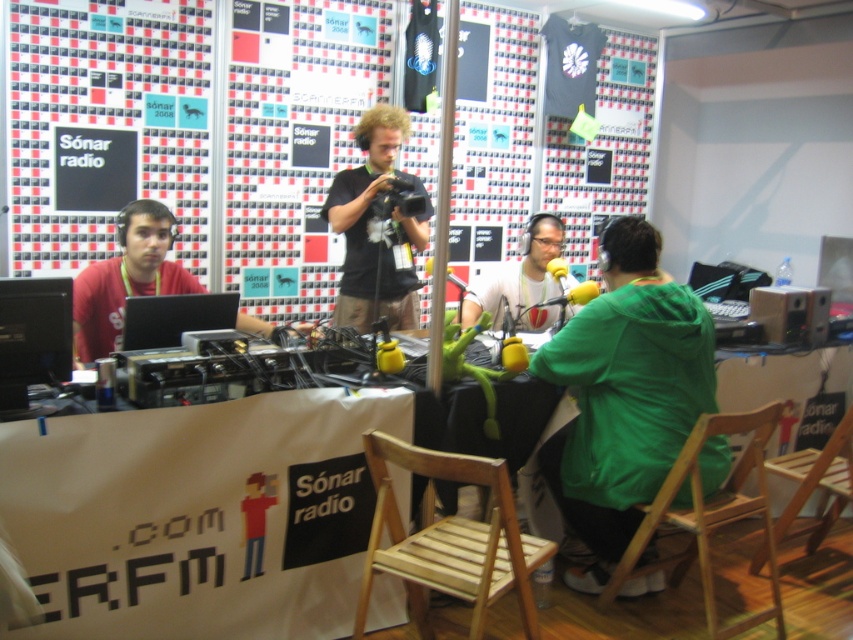
Question: Is green matte jacket at lower right to the left of wooden chair at center from the viewer's perspective?

Choices:
 (A) no
 (B) yes

Answer: (A)

Question: Can you confirm if wooden chair at lower right is positioned above green matte jacket at center?

Choices:
 (A) no
 (B) yes

Answer: (A)

Question: Among these points, which one is nearest to the camera?

Choices:
 (A) (514, 262)
 (B) (653, 454)
 (C) (392, 570)

Answer: (C)

Question: Can you confirm if wooden chair at lower right is positioned to the left of matte black camera at center?

Choices:
 (A) yes
 (B) no

Answer: (B)

Question: Which object is the farthest from the wooden chair at center?

Choices:
 (A) green matte jacket at center
 (B) matte black camera at center
 (C) wooden chair at lower right
 (D) green matte jacket at lower right

Answer: (B)

Question: Which object is the closest to the matte black camera at center?

Choices:
 (A) wooden chair at lower right
 (B) green matte jacket at lower right
 (C) wooden chair at center
 (D) green matte jacket at center

Answer: (D)